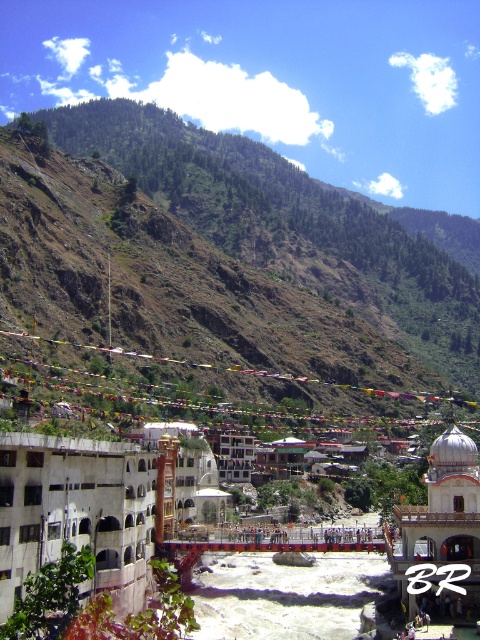
You are planning to build a small garden on the slope between the green grassy hillside at upper center and the white stucco building at center. Considering their heights, which one should you place the garden closer to for better sunlight exposure?

The green grassy hillside at upper center is taller than the white stucco building at center, so placing the garden closer to the white stucco building at center would ensure better sunlight exposure as it is shorter and less likely to block the sun.

You are a landscape architect designing a new park in the valley. You need to place a large statue that requires a wide open space. Based on the scene, which area would you choose between the green grassy hillside at upper center and the white stucco building at center?

The green grassy hillside at upper center has a greater width than the white stucco building at center, so the statue should be placed on the green grassy hillside at upper center to accommodate its space requirements.